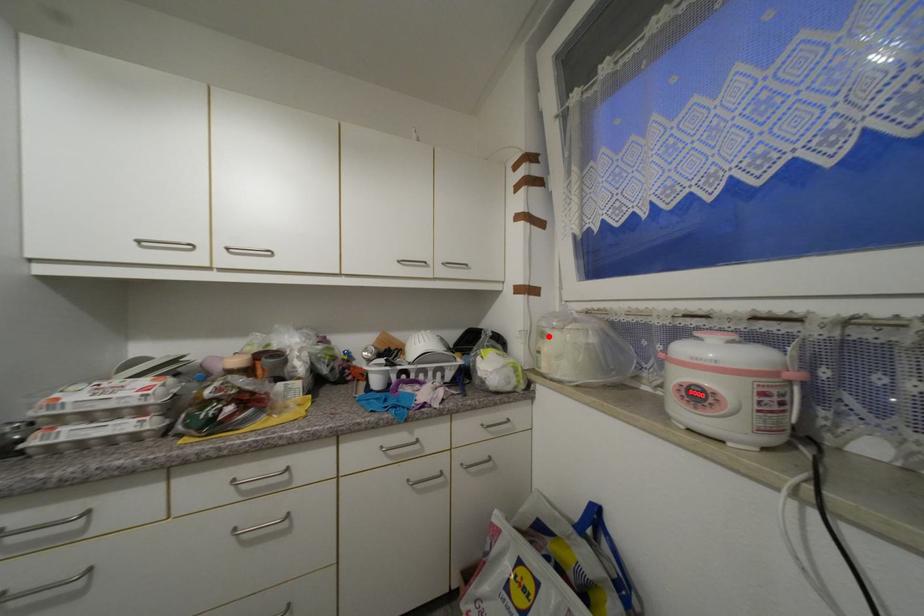
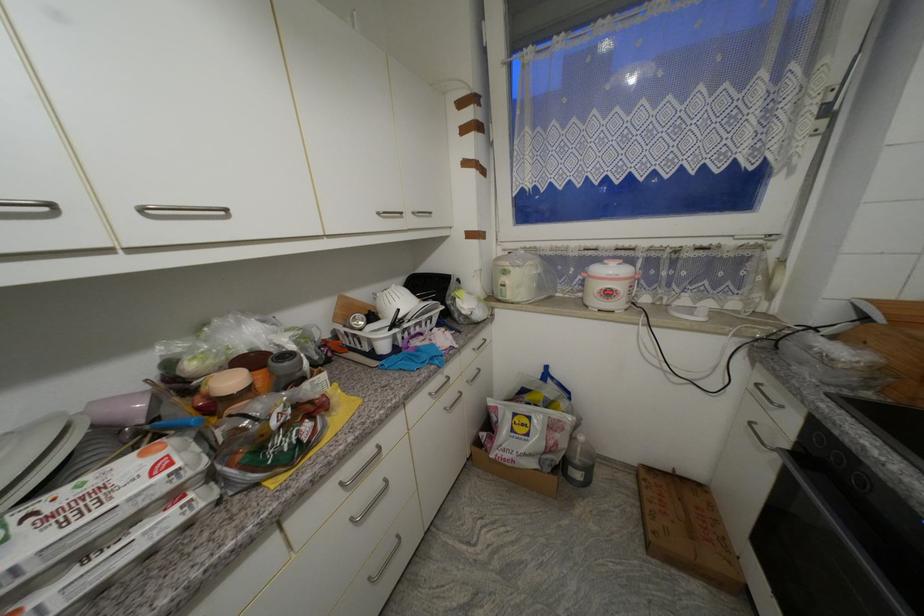
Locate, in the second image, the point that corresponds to the highlighted location in the first image.

(511, 274)